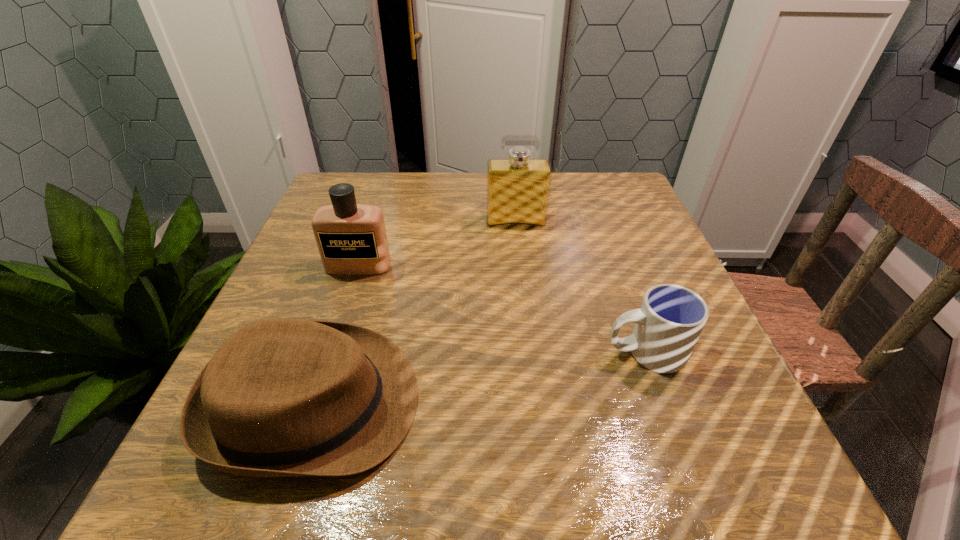
Where is `the second object from right to left`? The image size is (960, 540). the second object from right to left is located at coordinates (518, 187).

Locate an element on the screen. the farther perfume is located at coordinates (518, 187).

Where is `the third nearest object`? the third nearest object is located at coordinates (351, 238).

At what (x,y) coordinates should I click in order to perform the action: click on the left perfume. Please return your answer as a coordinate pair (x, y). The height and width of the screenshot is (540, 960). Looking at the image, I should click on (351, 238).

The width and height of the screenshot is (960, 540). I want to click on the rightmost object, so click(x=667, y=326).

Locate an element on the screen. This screenshot has height=540, width=960. fedora is located at coordinates (284, 397).

I want to click on blank space located 0.110m on the front-facing side of the farther perfume, so click(x=519, y=257).

Where is `vacant area situated 0.250m on the front label of the left perfume`? This screenshot has width=960, height=540. vacant area situated 0.250m on the front label of the left perfume is located at coordinates (323, 374).

The height and width of the screenshot is (540, 960). In order to click on vacant position located 0.260m with the handle on the side of the cup in this screenshot , I will do `click(455, 352)`.

Image resolution: width=960 pixels, height=540 pixels. Find the location of `vacant area situated 0.110m with the handle on the side of the cup`. vacant area situated 0.110m with the handle on the side of the cup is located at coordinates (541, 352).